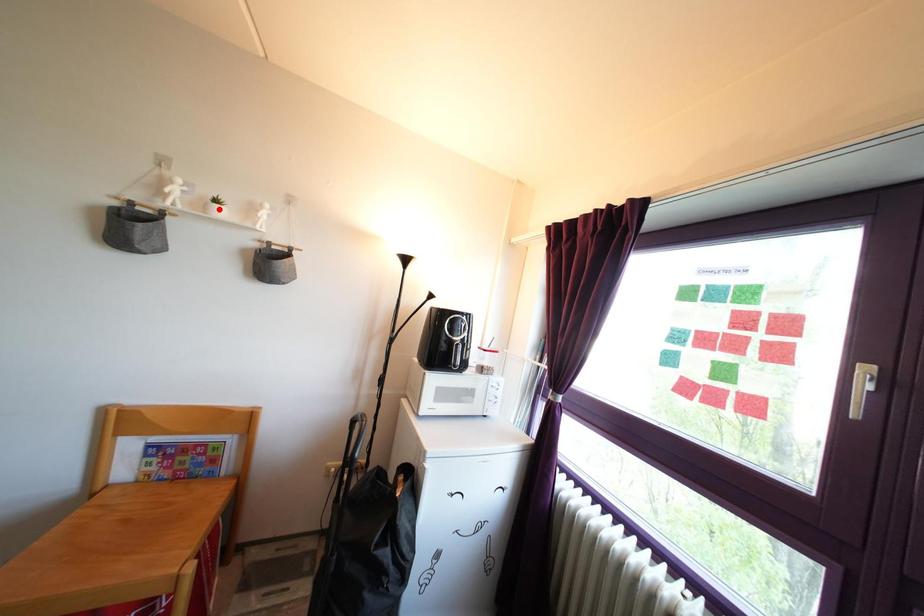
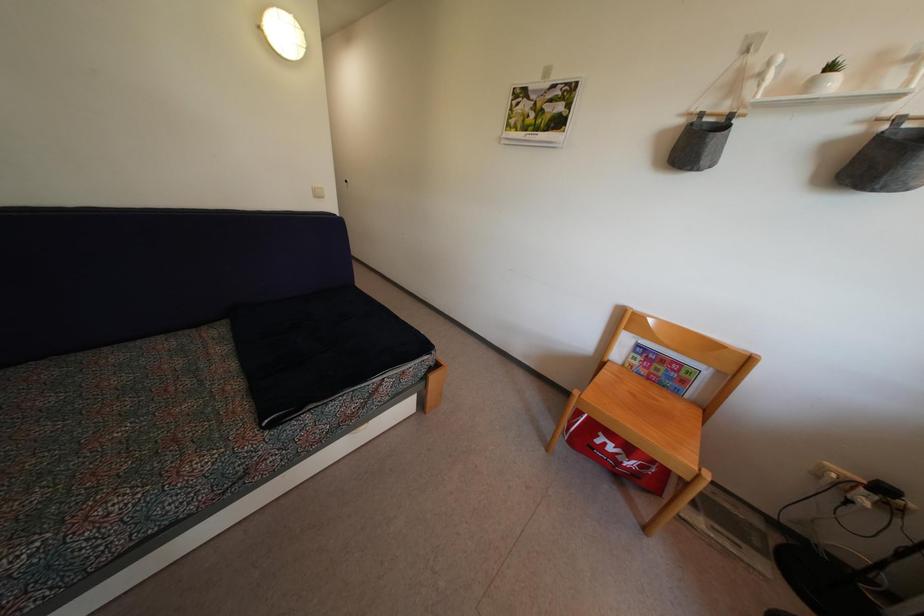
Find the pixel in the second image that matches the highlighted location in the first image.

(833, 76)